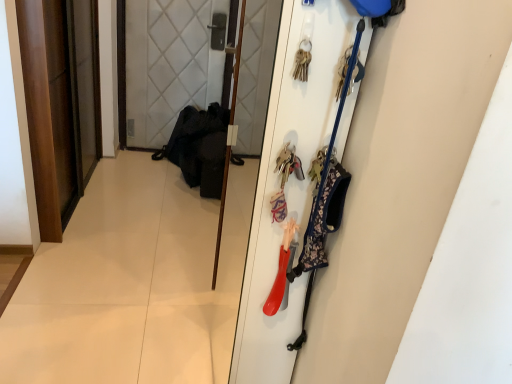
You are a GUI agent. You are given a task and a screenshot of the screen. Output one action in this format:
    pyautogui.click(x=<x>, y=<y>)
    Task: Click on the matte plastic door at right, the second door in the back-to-front sequence
    The image size is (512, 384).
    Given the screenshot: What is the action you would take?
    pyautogui.click(x=401, y=178)

What do you see at coordinates (221, 215) in the screenshot? I see `wooden screen door at center` at bounding box center [221, 215].

Where is `matte plastic door at right, which appears as the first door when viewed from the front`? This screenshot has height=384, width=512. matte plastic door at right, which appears as the first door when viewed from the front is located at coordinates (401, 178).

Which is more to the left, wooden door at left, the first door when ordered from back to front, or wooden screen door at center?

From the viewer's perspective, wooden door at left, the first door when ordered from back to front, appears more on the left side.

Consider the image. From a real-world perspective, between wooden door at left, the 2th door from the right, and wooden screen door at center, who is vertically lower?

wooden door at left, the 2th door from the right.

Is wooden door at left, the 1th door in the left-to-right sequence, taller or shorter than wooden screen door at center?

Clearly, wooden door at left, the 1th door in the left-to-right sequence, is shorter compared to wooden screen door at center.

Can you tell me how much matte plastic door at right, the second door in the back-to-front sequence, and wooden screen door at center differ in facing direction?

There is a 9.93-degree angle between the facing directions of matte plastic door at right, the second door in the back-to-front sequence, and wooden screen door at center.

Could you measure the distance between matte plastic door at right, the 2th door viewed from the left, and wooden screen door at center?

matte plastic door at right, the 2th door viewed from the left, is 1.32 meters from wooden screen door at center.

Is matte plastic door at right, which appears as the first door when viewed from the front, inside the boundaries of wooden screen door at center, or outside?

matte plastic door at right, which appears as the first door when viewed from the front, is located beyond the bounds of wooden screen door at center.

From the image's perspective, is matte plastic door at right, the first door from the right, positioned above or below wooden screen door at center?

matte plastic door at right, the first door from the right, is situated lower than wooden screen door at center in the image.

From the image's perspective, which one is positioned higher, wooden door at left, acting as the 2th door starting from the front, or matte plastic door at right, the second door in the back-to-front sequence?

wooden door at left, acting as the 2th door starting from the front, from the image's perspective.

Does wooden door at left, the first door when ordered from back to front, come in front of matte plastic door at right, the 2th door viewed from the left?

No, wooden door at left, the first door when ordered from back to front, is behind matte plastic door at right, the 2th door viewed from the left.

In terms of width, does wooden door at left, acting as the 2th door starting from the front, look wider or thinner when compared to matte plastic door at right, which appears as the first door when viewed from the front?

Clearly, wooden door at left, acting as the 2th door starting from the front, has less width compared to matte plastic door at right, which appears as the first door when viewed from the front.

Is wooden door at left, the 1th door in the left-to-right sequence, beside matte plastic door at right, which appears as the first door when viewed from the front?

No, wooden door at left, the 1th door in the left-to-right sequence, is not with matte plastic door at right, which appears as the first door when viewed from the front.

Can you tell me how much matte plastic door at right, the first door from the right, and wooden door at left, the 1th door in the left-to-right sequence, differ in facing direction?

There is a 180-degree angle between the facing directions of matte plastic door at right, the first door from the right, and wooden door at left, the 1th door in the left-to-right sequence.

Considering the relative sizes of matte plastic door at right, which appears as the first door when viewed from the front, and wooden door at left, the 1th door in the left-to-right sequence, in the image provided, is matte plastic door at right, which appears as the first door when viewed from the front, taller than wooden door at left, the 1th door in the left-to-right sequence,?

Yes, matte plastic door at right, which appears as the first door when viewed from the front, is taller than wooden door at left, the 1th door in the left-to-right sequence.

From the image's perspective, is matte plastic door at right, which appears as the first door when viewed from the front, located above or below wooden door at left, the 2th door from the right?

Based on their image positions, matte plastic door at right, which appears as the first door when viewed from the front, is located beneath wooden door at left, the 2th door from the right.

Find the location of a particular element. The width and height of the screenshot is (512, 384). door that appears on the left of matte plastic door at right, the 2th door viewed from the left is located at coordinates (60, 103).

From the image's perspective, which is below, wooden screen door at center or wooden door at left, the 1th door in the left-to-right sequence?

wooden screen door at center.

Is point (236, 74) positioned in front of point (45, 216)?

That is False.

Is the depth of wooden screen door at center less than that of wooden door at left, acting as the 2th door starting from the front?

Yes, wooden screen door at center is in front of wooden door at left, acting as the 2th door starting from the front.

Which of these two, wooden screen door at center or wooden door at left, acting as the 2th door starting from the front, is thinner?

Thinner between the two is wooden screen door at center.

Consider the image. Would you say wooden screen door at center contains matte plastic door at right, the second door in the back-to-front sequence?

Definitely not — matte plastic door at right, the second door in the back-to-front sequence, is not inside wooden screen door at center.

Does wooden screen door at center lie behind matte plastic door at right, the first door from the right?

Yes, wooden screen door at center is further from the viewer.

Considering the points (239, 31) and (423, 146), which point is in front, point (239, 31) or point (423, 146)?

The point (423, 146) is more forward.

Considering the relative sizes of wooden screen door at center and matte plastic door at right, the first door from the right, in the image provided, is wooden screen door at center wider than matte plastic door at right, the first door from the right,?

In fact, wooden screen door at center might be narrower than matte plastic door at right, the first door from the right.

Identify the location of door above the wooden screen door at center (from the image's perspective). (60, 103).

Where is `door located on the right of wooden screen door at center`? Image resolution: width=512 pixels, height=384 pixels. door located on the right of wooden screen door at center is located at coordinates pos(401,178).

From the image, which object appears to be farther from wooden door at left, acting as the 2th door starting from the front, wooden screen door at center or matte plastic door at right, the 2th door viewed from the left?

matte plastic door at right, the 2th door viewed from the left, lies further to wooden door at left, acting as the 2th door starting from the front, than the other object.

Considering their positions, is matte plastic door at right, which appears as the first door when viewed from the front, positioned closer to wooden screen door at center than wooden door at left, acting as the 2th door starting from the front?

Among the two, wooden door at left, acting as the 2th door starting from the front, is located nearer to wooden screen door at center.

Looking at the image, which one is located further to matte plastic door at right, the first door from the right, wooden door at left, the first door when ordered from back to front, or wooden screen door at center?

wooden door at left, the first door when ordered from back to front, is further to matte plastic door at right, the first door from the right.

Consider the image. Estimate the real-world distances between objects in this image. Which object is closer to matte plastic door at right, which appears as the first door when viewed from the front, wooden screen door at center or wooden door at left, acting as the 2th door starting from the front?

wooden screen door at center lies closer to matte plastic door at right, which appears as the first door when viewed from the front, than the other object.

Which object lies further to the anchor point wooden door at left, the 2th door from the right, matte plastic door at right, the first door from the right, or wooden screen door at center?

Based on the image, matte plastic door at right, the first door from the right, appears to be further to wooden door at left, the 2th door from the right.

Estimate the real-world distances between objects in this image. Which object is closer to wooden screen door at center, wooden door at left, the 2th door from the right, or matte plastic door at right, the second door in the back-to-front sequence?

wooden door at left, the 2th door from the right, lies closer to wooden screen door at center than the other object.

Where is `screen door between wooden door at left, the first door when ordered from back to front, and matte plastic door at right, the first door from the right`? This screenshot has height=384, width=512. screen door between wooden door at left, the first door when ordered from back to front, and matte plastic door at right, the first door from the right is located at coordinates (221, 215).